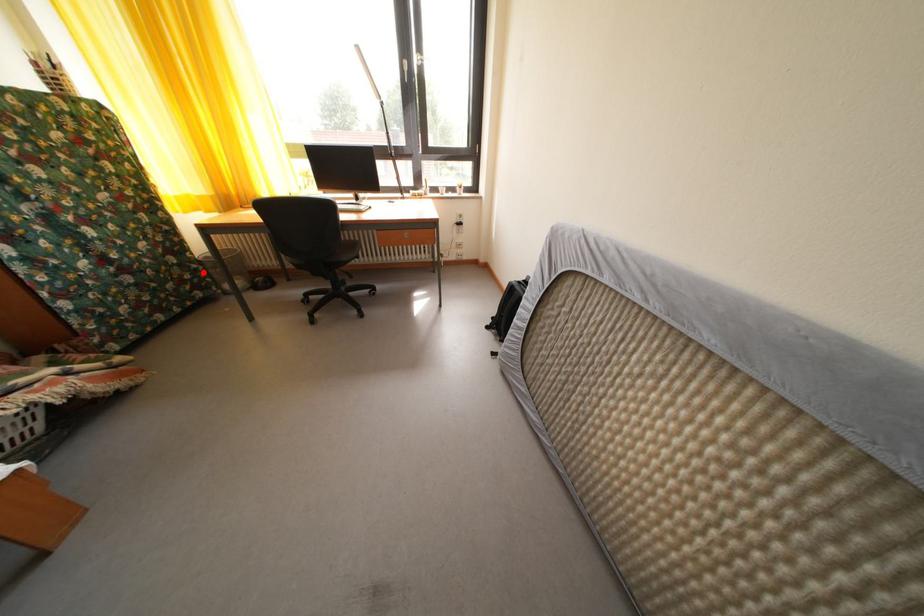
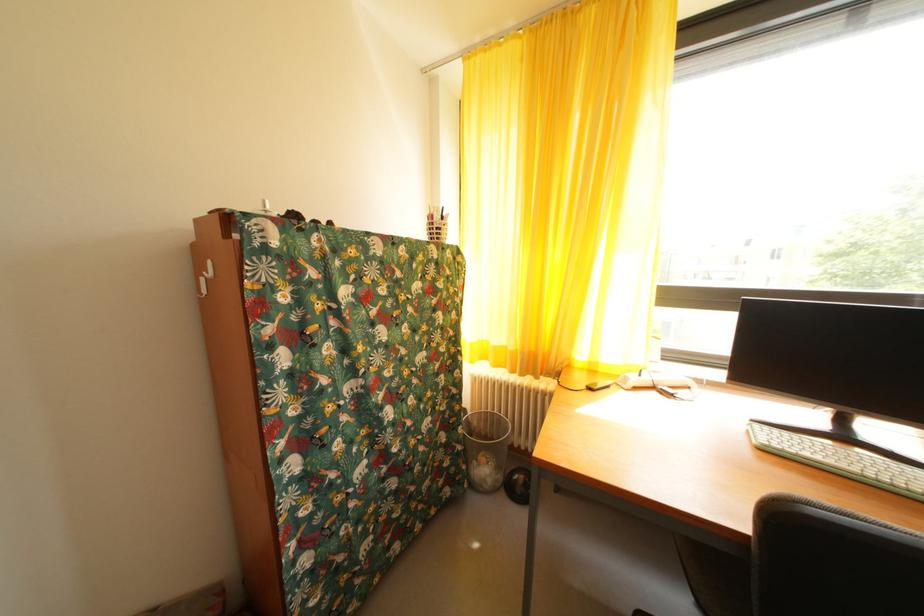
Question: I am providing you with two images of the same scene from different viewpoints. A red point is shown in image1. For the corresponding object point in image2, is it positioned nearer or farther from the camera?

Choices:
 (A) Nearer
 (B) Farther

Answer: (A)